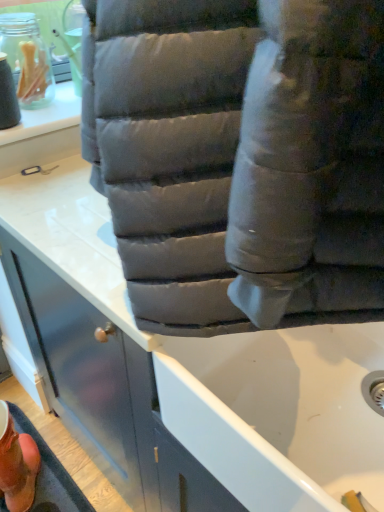
Question: Is point (23, 498) closer or farther from the camera than point (201, 376)?

Choices:
 (A) closer
 (B) farther

Answer: (B)

Question: Choose the correct answer: Is orange suede boot at lower left inside matte gray cushion at lower center or outside it?

Choices:
 (A) inside
 (B) outside

Answer: (B)

Question: In terms of height, does orange suede boot at lower left look taller or shorter compared to matte gray cushion at lower center?

Choices:
 (A) short
 (B) tall

Answer: (B)

Question: Looking at the image, does matte gray cushion at lower center seem bigger or smaller compared to orange suede boot at lower left?

Choices:
 (A) big
 (B) small

Answer: (A)

Question: Is point (218, 476) positioned closer to the camera than point (4, 480)?

Choices:
 (A) closer
 (B) farther

Answer: (A)

Question: Considering the relative positions of matte gray cushion at lower center and orange suede boot at lower left in the image provided, is matte gray cushion at lower center to the left or to the right of orange suede boot at lower left?

Choices:
 (A) right
 (B) left

Answer: (A)

Question: Would you say matte gray cushion at lower center is inside or outside orange suede boot at lower left?

Choices:
 (A) outside
 (B) inside

Answer: (A)